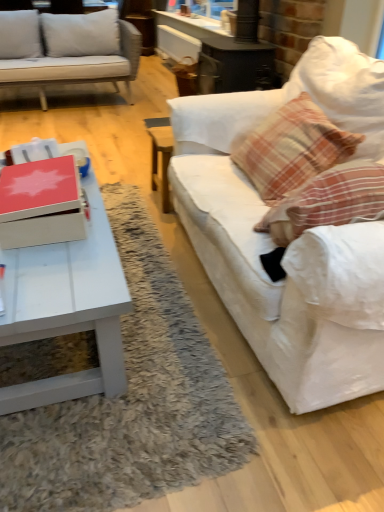
Question: Would you say plaid fabric pillow at right is to the left or to the right of matte red box at center in the picture?

Choices:
 (A) right
 (B) left

Answer: (A)

Question: In terms of height, does plaid fabric pillow at right look taller or shorter compared to matte red box at center?

Choices:
 (A) tall
 (B) short

Answer: (A)

Question: Which object is the closest to the plaid fabric pillow at right?

Choices:
 (A) matte red box at center
 (B) white fabric couch at right
 (C) white matte coffee table at lower left

Answer: (B)

Question: Considering the real-world distances, which object is closest to the white fabric couch at right?

Choices:
 (A) plaid fabric pillow at right
 (B) white matte coffee table at lower left
 (C) matte red box at center

Answer: (A)